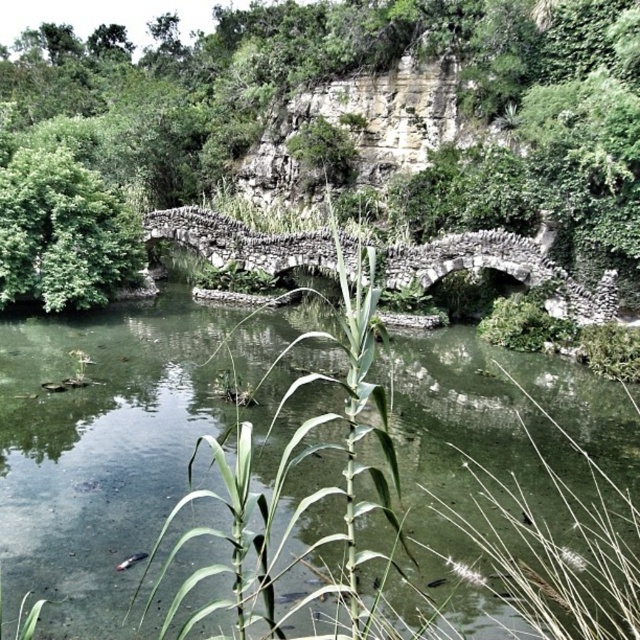
You are standing on the bank of the water and see the green stone bridge at center and the green leafy tree at center. Which object is taller from your viewpoint?

The green leafy tree at center is taller than the green stone bridge at center from your viewpoint.

You are standing on the green stone bridge at center and want to look at the green leafy tree at center. Which direction should you look to see the tree?

The green leafy tree at center is behind the green stone bridge at center, so you should look behind the green stone bridge at center to see the tree.